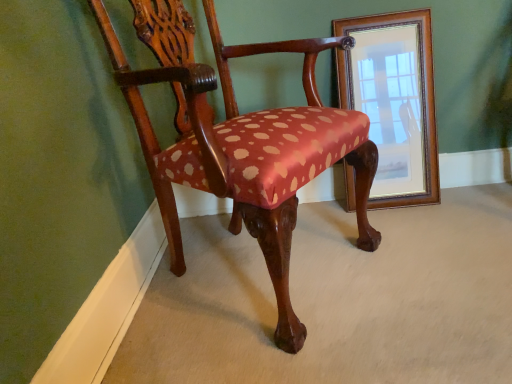
In order to face polished wood chair at center, should I rotate leftwards or rightwards?

To align with it, rotate left about 0.614°.

What is the approximate width of polished wood chair at center?

polished wood chair at center is 59.24 centimeters in width.

What do you see at coordinates (211, 147) in the screenshot?
I see `polished wood chair at center` at bounding box center [211, 147].

Locate an element on the screen. polished wood chair at center is located at coordinates (211, 147).

This screenshot has height=384, width=512. What do you see at coordinates (394, 101) in the screenshot? I see `wooden framed mirror at upper right` at bounding box center [394, 101].

What is the approximate height of wooden framed mirror at upper right?

wooden framed mirror at upper right is 31.49 inches in height.

Identify the location of wooden framed mirror at upper right. Image resolution: width=512 pixels, height=384 pixels. (394, 101).

Locate an element on the screen. polished wood chair at center is located at coordinates (211, 147).

Between polished wood chair at center and wooden framed mirror at upper right, which one appears on the left side from the viewer's perspective?

From the viewer's perspective, polished wood chair at center appears more on the left side.

Which object is closer to the camera taking this photo, polished wood chair at center or wooden framed mirror at upper right?

Positioned in front is polished wood chair at center.

Considering the points (280, 345) and (402, 187), which point is behind, point (280, 345) or point (402, 187)?

The point (402, 187) is farther from the camera.

From the image's perspective, which one is positioned lower, polished wood chair at center or wooden framed mirror at upper right?

From the image's view, polished wood chair at center is below.

From a real-world perspective, is polished wood chair at center above or below wooden framed mirror at upper right?

polished wood chair at center is situated higher than wooden framed mirror at upper right in the real world.

Which object is thinner, polished wood chair at center or wooden framed mirror at upper right?

wooden framed mirror at upper right is thinner.

In terms of height, does polished wood chair at center look taller or shorter compared to wooden framed mirror at upper right?

Considering their sizes, polished wood chair at center has more height than wooden framed mirror at upper right.

Based on their sizes in the image, would you say polished wood chair at center is bigger or smaller than wooden framed mirror at upper right?

Considering their sizes, polished wood chair at center takes up more space than wooden framed mirror at upper right.

Can wooden framed mirror at upper right be found inside polished wood chair at center?

No, wooden framed mirror at upper right is located outside of polished wood chair at center.

Are polished wood chair at center and wooden framed mirror at upper right far apart?

They are positioned close to each other.

Is wooden framed mirror at upper right at the back of polished wood chair at center?

polished wood chair at center is not turned away from wooden framed mirror at upper right.

How different are the orientations of polished wood chair at center and wooden framed mirror at upper right in degrees?

57.6 degrees.

I want to click on picture frame directly beneath the polished wood chair at center (from a real-world perspective), so click(x=394, y=101).

Considering the positions of objects wooden framed mirror at upper right and polished wood chair at center in the image provided, who is more to the left, wooden framed mirror at upper right or polished wood chair at center?

polished wood chair at center.

Considering their positions, is wooden framed mirror at upper right located in front of or behind polished wood chair at center?

In the image, wooden framed mirror at upper right appears behind polished wood chair at center.

Does point (426, 194) lie in front of point (281, 313)?

No, (426, 194) is further to viewer.

From the image's perspective, is wooden framed mirror at upper right on top of polished wood chair at center?

Yes, from the image's perspective, wooden framed mirror at upper right is above polished wood chair at center.

From a real-world perspective, who is located lower, wooden framed mirror at upper right or polished wood chair at center?

wooden framed mirror at upper right, from a real-world perspective.

From the picture: Which object is wider, wooden framed mirror at upper right or polished wood chair at center?

With larger width is polished wood chair at center.

Is wooden framed mirror at upper right shorter than polished wood chair at center?

Yes.

Which of these two, wooden framed mirror at upper right or polished wood chair at center, is bigger?

polished wood chair at center.

Is polished wood chair at center a part of wooden framed mirror at upper right?

No, polished wood chair at center is not inside wooden framed mirror at upper right.

Is wooden framed mirror at upper right in contact with polished wood chair at center?

No, wooden framed mirror at upper right is not with polished wood chair at center.

Is wooden framed mirror at upper right facing away from polished wood chair at center?

No, wooden framed mirror at upper right is not facing the opposite direction of polished wood chair at center.

Measure the distance between wooden framed mirror at upper right and polished wood chair at center.

A distance of 41.79 centimeters exists between wooden framed mirror at upper right and polished wood chair at center.

You are a GUI agent. You are given a task and a screenshot of the screen. Output one action in this format:
    pyautogui.click(x=<x>, y=<y>)
    Task: Click on the chair in front of the wooden framed mirror at upper right
    The width and height of the screenshot is (512, 384).
    Given the screenshot: What is the action you would take?
    [211, 147]

Where is `chair to the left of wooden framed mirror at upper right`? The width and height of the screenshot is (512, 384). chair to the left of wooden framed mirror at upper right is located at coordinates (211, 147).

In order to click on chair below the wooden framed mirror at upper right (from the image's perspective) in this screenshot , I will do `click(211, 147)`.